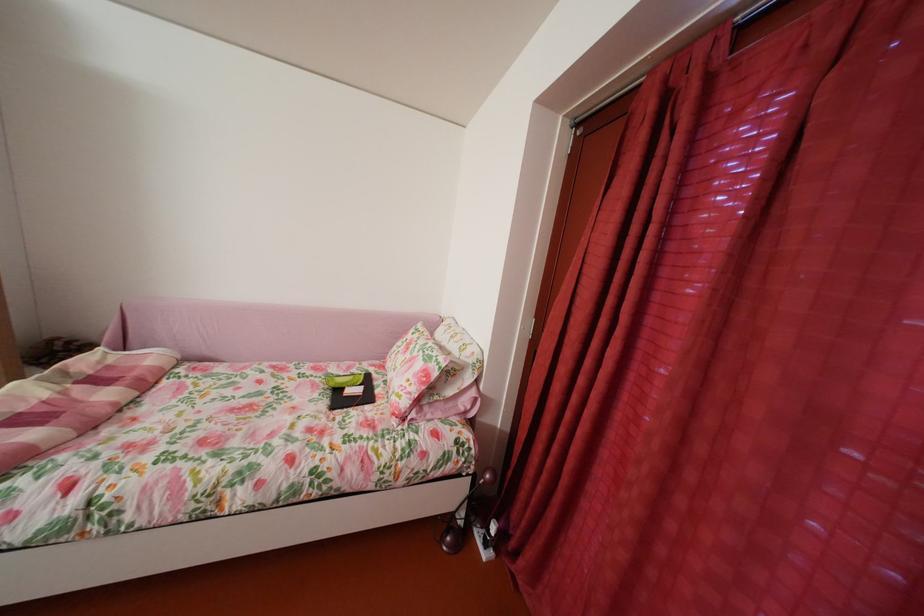
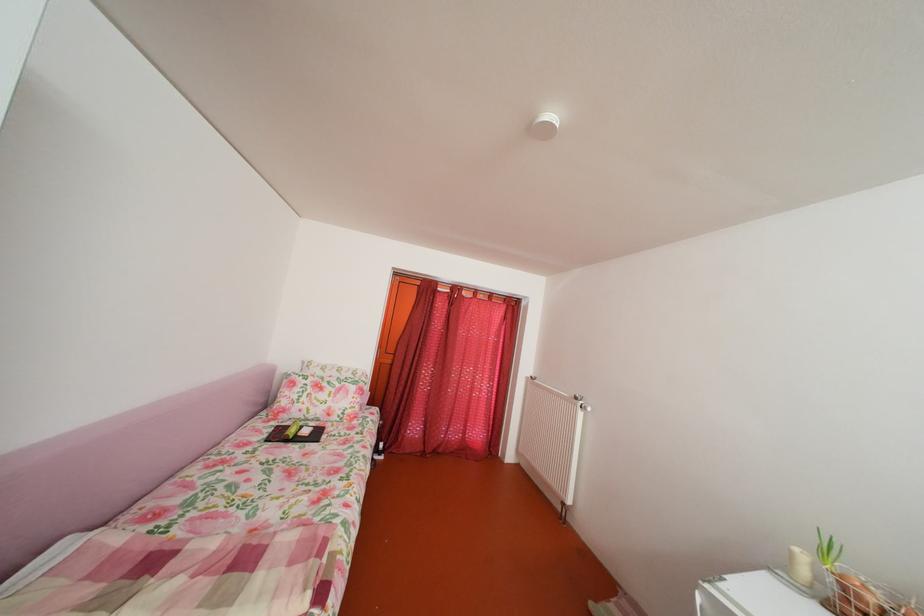
Locate, in the second image, the point that corresponds to (x=383, y=376) in the first image.

(286, 430)